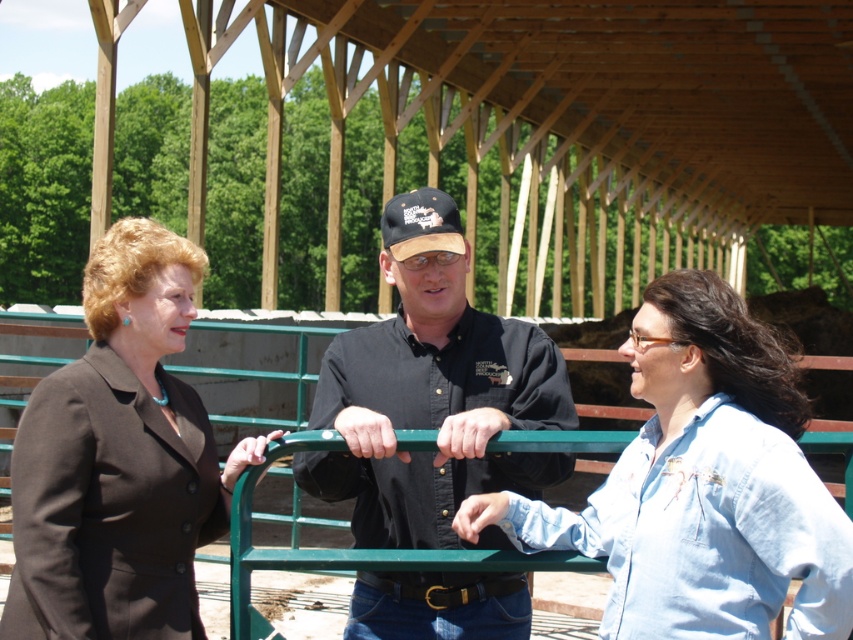
Question: Observing the image, what is the correct spatial positioning of matte black suit at left in reference to black cotton shirt at center?

Choices:
 (A) above
 (B) below

Answer: (B)

Question: From the image, what is the correct spatial relationship of matte black shirt at center in relation to black cotton shirt at center?

Choices:
 (A) left
 (B) right

Answer: (A)

Question: Which of the following is the farthest from the observer?

Choices:
 (A) (723, 444)
 (B) (138, 273)
 (C) (477, 544)

Answer: (C)

Question: Which of the following is the closest to the observer?

Choices:
 (A) (357, 419)
 (B) (27, 429)

Answer: (A)

Question: Which point is farther from the camera taking this photo?

Choices:
 (A) (518, 348)
 (B) (155, 296)

Answer: (A)

Question: Does matte black shirt at center have a smaller size compared to black cotton shirt at center?

Choices:
 (A) no
 (B) yes

Answer: (A)